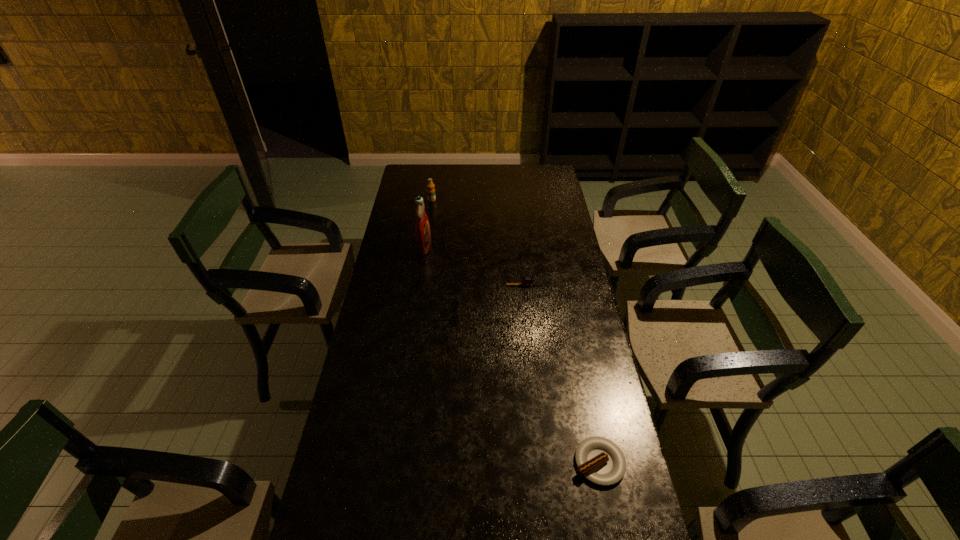
The width and height of the screenshot is (960, 540). Find the location of `detergent`. detergent is located at coordinates (422, 229).

What are the coordinates of `the tallest object` in the screenshot? It's located at (422, 229).

The height and width of the screenshot is (540, 960). In order to click on orange juice in this screenshot , I will do `click(430, 186)`.

Locate an element on the screen. the farthest object is located at coordinates (430, 186).

I want to click on the second nearest object, so click(x=442, y=292).

You are a GUI agent. You are given a task and a screenshot of the screen. Output one action in this format:
    pyautogui.click(x=<x>, y=<y>)
    Task: Click on the third object from left to right
    This screenshot has height=540, width=960.
    Given the screenshot: What is the action you would take?
    pyautogui.click(x=442, y=292)

At what (x,y) coordinates should I click in order to perform the action: click on the third farthest object. Please return your answer as a coordinate pair (x, y). The height and width of the screenshot is (540, 960). Looking at the image, I should click on (526, 281).

Locate an element on the screen. The height and width of the screenshot is (540, 960). tape measure is located at coordinates (526, 281).

The height and width of the screenshot is (540, 960). Find the location of `the rightmost object`. the rightmost object is located at coordinates (600, 460).

The height and width of the screenshot is (540, 960). Find the location of `the nearest object`. the nearest object is located at coordinates (600, 460).